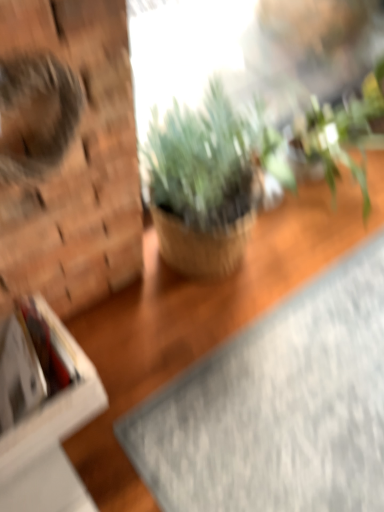
Question: From the image's perspective, relative to white cardboard box at left, is gray textured yoga mat at lower right above or below?

Choices:
 (A) above
 (B) below

Answer: (B)

Question: From a real-world perspective, is gray textured yoga mat at lower right above or below white cardboard box at left?

Choices:
 (A) below
 (B) above

Answer: (A)

Question: Based on their relative distances, which object is farther from the white cardboard box at left?

Choices:
 (A) green matte plant at center, the 2th houseplant in the right-to-left sequence
 (B) green leafy plant at upper right, arranged as the first houseplant when viewed from the right
 (C) gray textured yoga mat at lower right
 (D) fuzzy brown cat at left

Answer: (B)

Question: Estimate the real-world distances between objects in this image. Which object is closer to the green matte plant at center, the 2th houseplant in the right-to-left sequence?

Choices:
 (A) gray textured yoga mat at lower right
 (B) white cardboard box at left
 (C) fuzzy brown cat at left
 (D) green leafy plant at upper right, which ranks as the second houseplant in left-to-right order

Answer: (D)